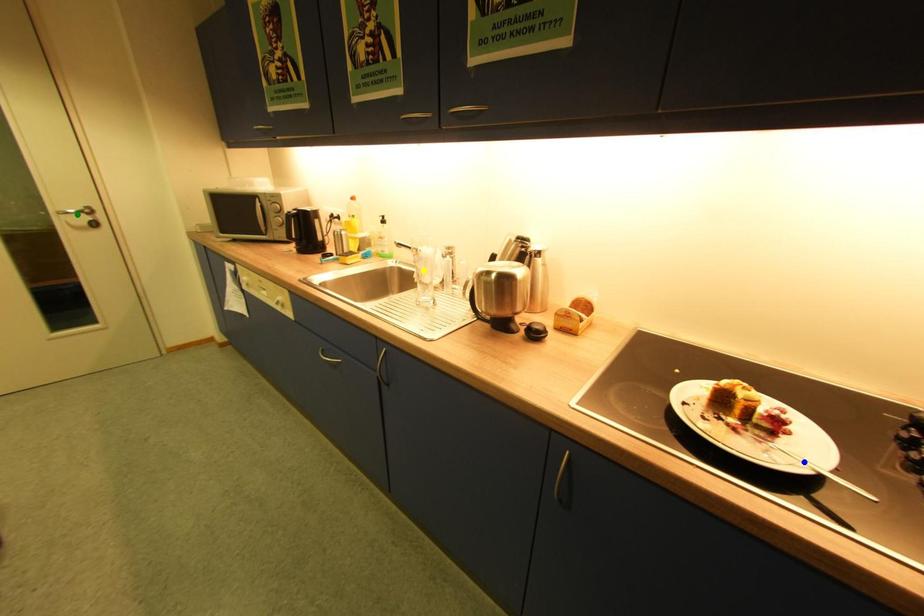
Order these from nearest to farthest:
yellow point, green point, blue point

blue point → yellow point → green point